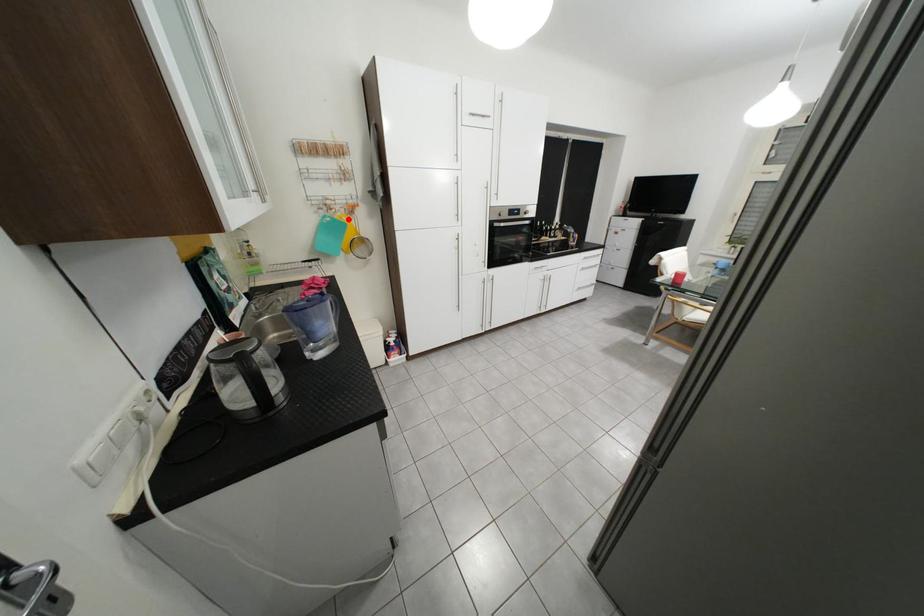
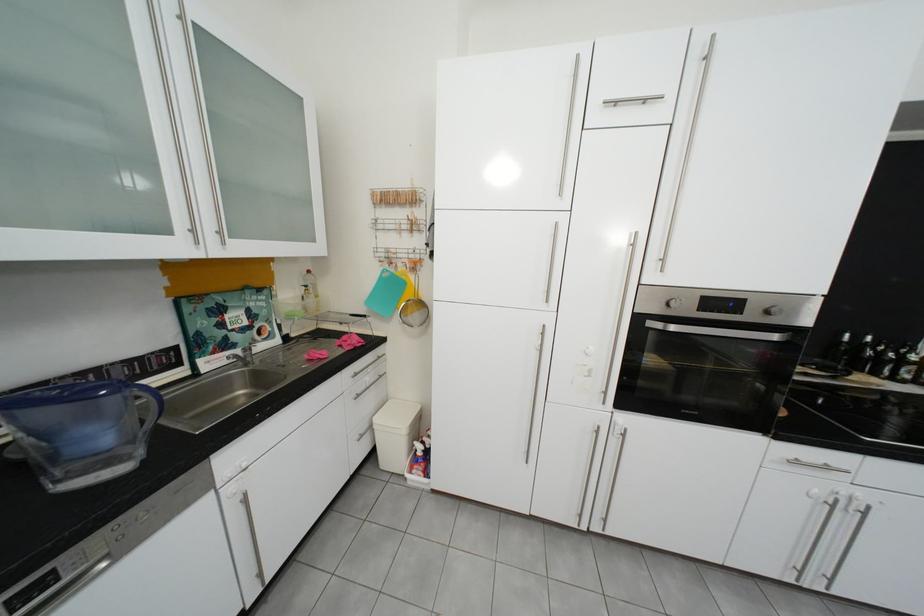
Question: I am providing you with two images of the same scene from different viewpoints. Image1 has a red point marked. In image2, the corresponding 3D location appears at what relative position? Reply with the corresponding letter.

Choices:
 (A) Closer
 (B) Farther

Answer: (B)